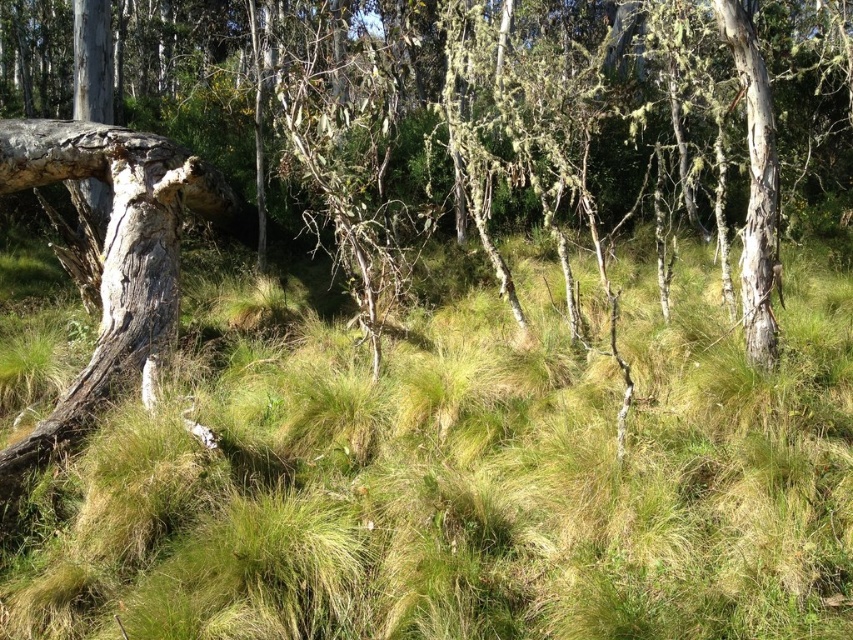
From the picture: Based on the scene description, where is the green grassy at center located in terms of its 2D coordinates?

The green grassy at center is located at the 2D coordinates of point (460,476).

You are standing in the forest and see the point marked at coordinates (460, 476). Based on the scene description, what would you expect to find at that location?

The point at coordinates (460, 476) indicates green grassy at center, so you would expect to find green grassy vegetation there.